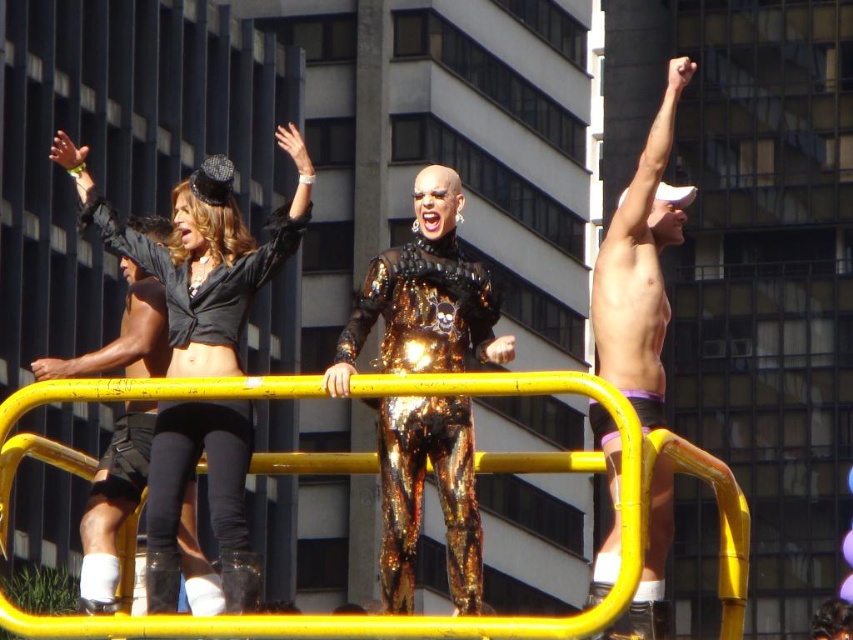
You are a photographer at the event and want to capture both the matte black top at upper left and the shiny metallic suit at center in a single shot. Which object should you focus on first to ensure both are in frame?

The matte black top at upper left has a greater height compared to the shiny metallic suit at center, so focusing on the taller matte black top at upper left first will help ensure both are in frame.

You are a photographer trying to capture the parade scene. You notice the shiny metallic suit at center and the shiny metallic shorts at upper right. Which object appears shorter in the photo?

The shiny metallic suit at center appears shorter than the shiny metallic shorts at upper right in the photo.

You are a photographer trying to capture the entire scene of the parade. You notice the shiny metallic suit at center and the shiny metallic shorts at upper right. Which object would require you to zoom out more to include it in your shot?

The shiny metallic shorts at upper right would require zooming out more because it occupies more space than the shiny metallic suit at center.